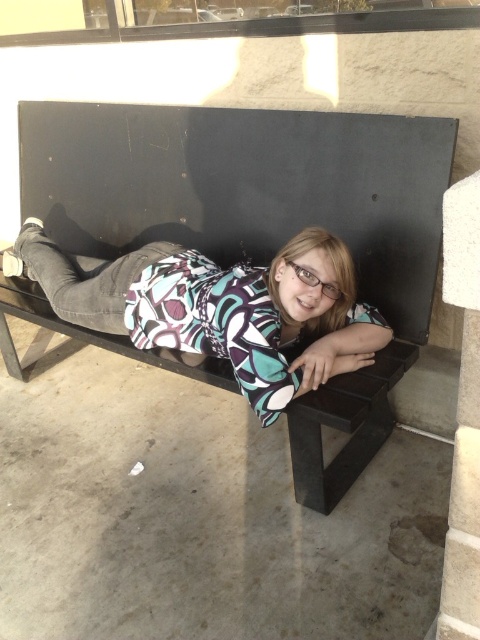
Question: Can you confirm if matte black bench at center is thinner than matte black shirt at center?

Choices:
 (A) yes
 (B) no

Answer: (B)

Question: Which point is closer to the camera taking this photo?

Choices:
 (A) (170, 307)
 (B) (434, 248)

Answer: (B)

Question: Can you confirm if matte black bench at center is smaller than matte black shirt at center?

Choices:
 (A) yes
 (B) no

Answer: (B)

Question: Among these objects, which one is farthest from the camera?

Choices:
 (A) matte black bench at center
 (B) matte black shirt at center

Answer: (B)

Question: Is matte black bench at center further to the viewer compared to matte black shirt at center?

Choices:
 (A) yes
 (B) no

Answer: (B)